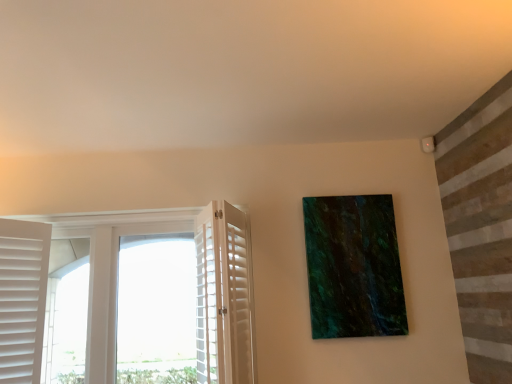
Question: Does point (205, 314) appear closer or farther from the camera than point (206, 301)?

Choices:
 (A) closer
 (B) farther

Answer: (B)

Question: In the image, is white wooden shutters at left on the left side or the right side of white wood screen door at left?

Choices:
 (A) right
 (B) left

Answer: (B)

Question: Which object is positioned closest to the white wood screen door at left?

Choices:
 (A) green marble painting at upper right
 (B) white wooden shutters at left

Answer: (A)

Question: Based on their relative distances, which object is farther from the white wood screen door at left?

Choices:
 (A) white wooden shutters at left
 (B) green marble painting at upper right

Answer: (A)